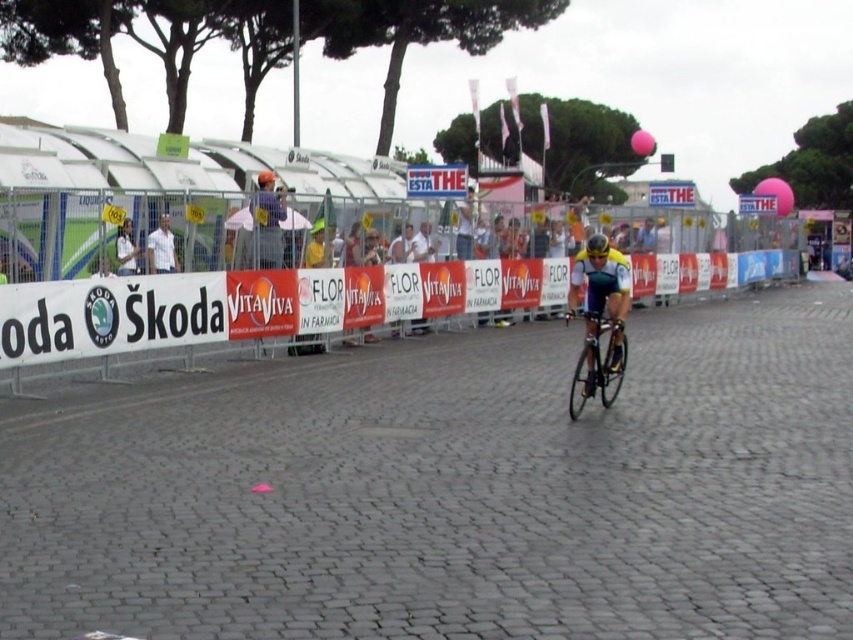
Can you confirm if white fabric shirt at left is positioned to the right of yellow matte bicycle helmet at center?

No, white fabric shirt at left is not to the right of yellow matte bicycle helmet at center.

Which is behind, point (134, 273) or point (598, 236)?

The point (134, 273) is behind.

Locate an element on the screen. This screenshot has width=853, height=640. white fabric shirt at left is located at coordinates (125, 248).

The height and width of the screenshot is (640, 853). In order to click on white fabric shirt at left in this screenshot , I will do `click(125, 248)`.

Is white shirt at left thinner than yellow matte bicycle helmet at center?

Indeed, white shirt at left has a lesser width compared to yellow matte bicycle helmet at center.

Is point (172, 250) in front of point (593, 250)?

No, (172, 250) is further to viewer.

Image resolution: width=853 pixels, height=640 pixels. Describe the element at coordinates (161, 248) in the screenshot. I see `white shirt at left` at that location.

I want to click on white shirt at left, so click(161, 248).

Between point (619, 611) and point (7, 339), which one is positioned behind?

Point (7, 339)

Is black asphalt road at center closer to camera compared to white plastic barrier at center?

Yes.

In order to click on black asphalt road at center in this screenshot , I will do `click(451, 490)`.

Where is `black asphalt road at center`? black asphalt road at center is located at coordinates (451, 490).